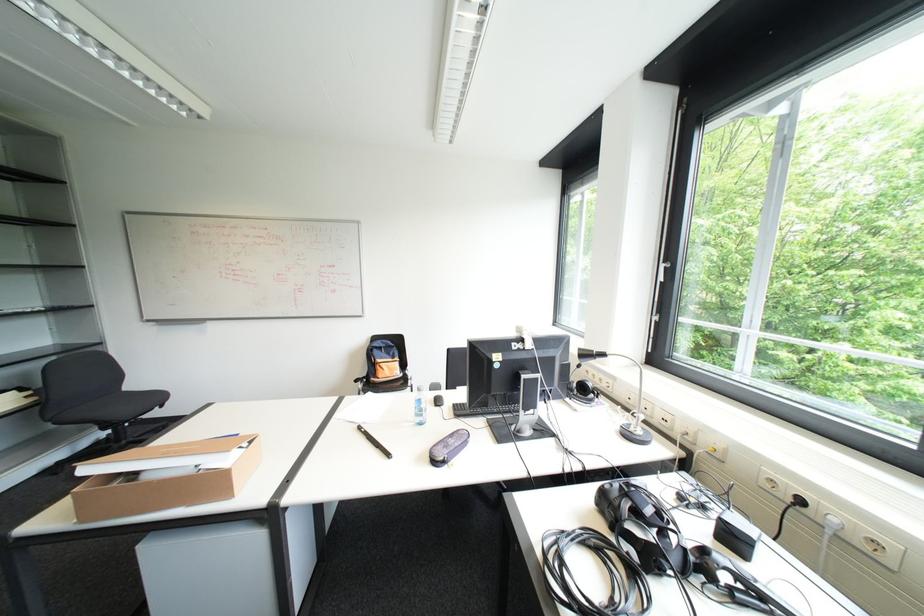
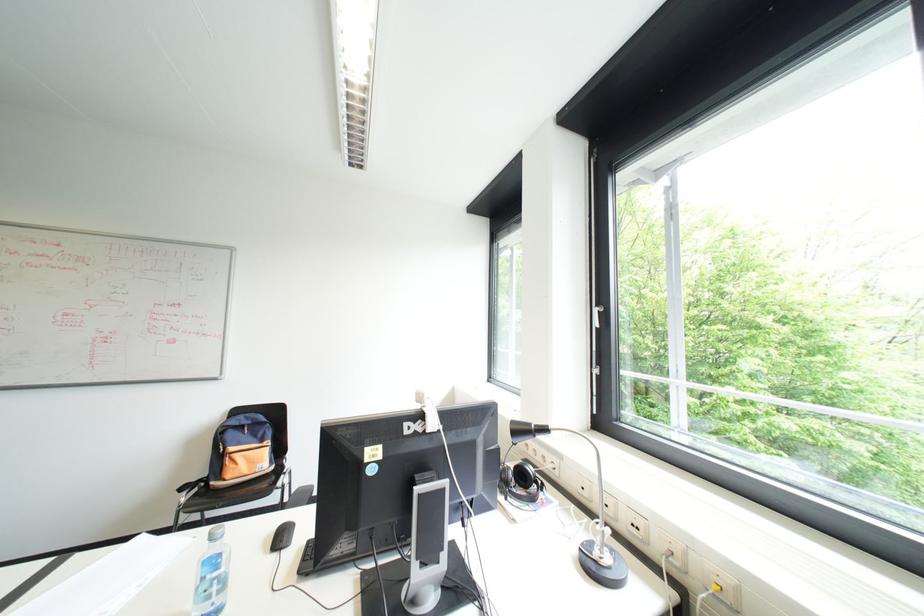
Question: The camera is either moving clockwise (left) or counter-clockwise (right) around the object. The first image is from the beginning of the video and the second image is from the end. Is the camera moving left or right when shooting the video?

Choices:
 (A) Left
 (B) Right

Answer: (A)